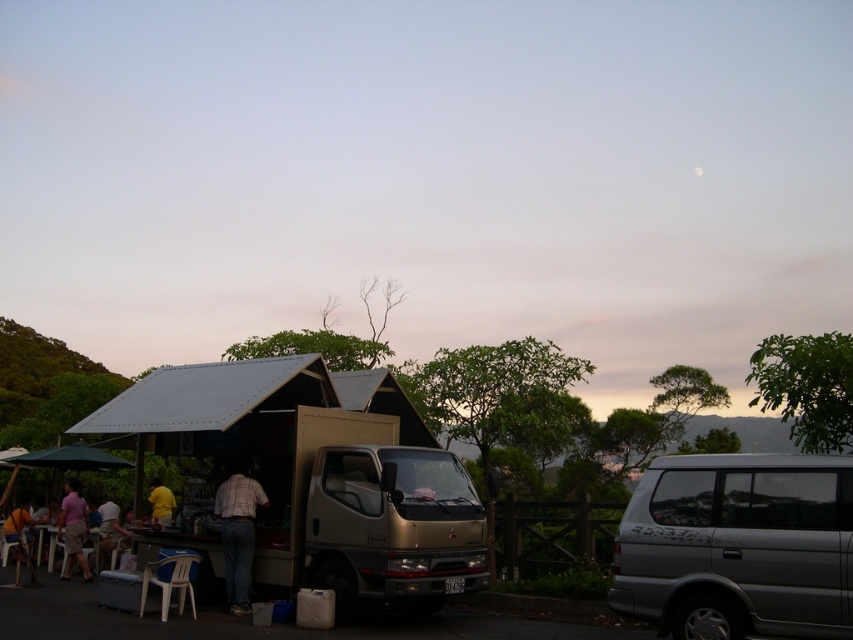
You are a delivery person trying to park your 1.5 meter wide van next to the metallic silver hut at center. Can you park your van next to the light brown plastic chair at lower left without overlapping them?

The metallic silver hut at center might be wider than the light brown plastic chair at lower left, so it is uncertain if there is enough space. Check the actual width before deciding.